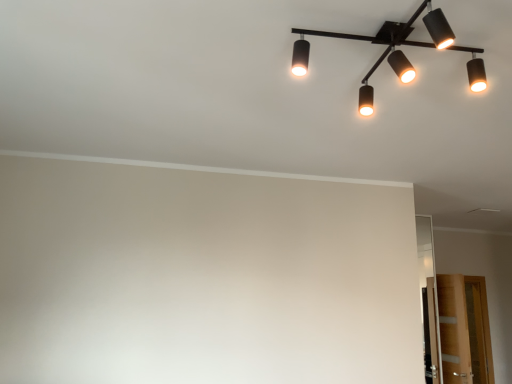
What do you see at coordinates (403, 35) in the screenshot? I see `matte black light fixture at upper center` at bounding box center [403, 35].

Locate an element on the screen. The width and height of the screenshot is (512, 384). matte black light fixture at upper center is located at coordinates (403, 35).

You are a GUI agent. You are given a task and a screenshot of the screen. Output one action in this format:
    pyautogui.click(x=<x>, y=<y>)
    Task: Click on the transparent glass door at lower right
    
    Given the screenshot: What is the action you would take?
    pyautogui.click(x=464, y=330)

What do you see at coordinates (464, 330) in the screenshot?
I see `transparent glass door at lower right` at bounding box center [464, 330].

Where is `matte black light fixture at upper center`? This screenshot has height=384, width=512. matte black light fixture at upper center is located at coordinates (403, 35).

From the picture: Considering the positions of objects matte black light fixture at upper center and transparent glass door at lower right in the image provided, who is more to the left, matte black light fixture at upper center or transparent glass door at lower right?

matte black light fixture at upper center.

Is the position of matte black light fixture at upper center more distant than that of transparent glass door at lower right?

No.

Is point (453, 46) positioned after point (464, 302)?

No.

From the image's perspective, between matte black light fixture at upper center and transparent glass door at lower right, who is located below?

From the image's view, transparent glass door at lower right is below.

From a real-world perspective, is matte black light fixture at upper center on transparent glass door at lower right?

Indeed, from a real-world perspective, matte black light fixture at upper center stands above transparent glass door at lower right.

In terms of width, does matte black light fixture at upper center look wider or thinner when compared to transparent glass door at lower right?

Clearly, matte black light fixture at upper center has more width compared to transparent glass door at lower right.

Between matte black light fixture at upper center and transparent glass door at lower right, which one has less height?

Standing shorter between the two is matte black light fixture at upper center.

Considering the relative sizes of matte black light fixture at upper center and transparent glass door at lower right in the image provided, is matte black light fixture at upper center smaller than transparent glass door at lower right?

Yes, matte black light fixture at upper center is smaller than transparent glass door at lower right.

Could transparent glass door at lower right be considered to be inside matte black light fixture at upper center?

Actually, transparent glass door at lower right is outside matte black light fixture at upper center.

Can you see matte black light fixture at upper center touching transparent glass door at lower right?

No.

Is matte black light fixture at upper center aimed at transparent glass door at lower right?

No, matte black light fixture at upper center is not aimed at transparent glass door at lower right.

What's the angular difference between matte black light fixture at upper center and transparent glass door at lower right's facing directions?

Result: The angle between the facing direction of matte black light fixture at upper center and the facing direction of transparent glass door at lower right is 5.62 degrees.

The image size is (512, 384). In order to click on glass door behind the matte black light fixture at upper center in this screenshot , I will do `click(464, 330)`.

Is transparent glass door at lower right at the right side of matte black light fixture at upper center?

Yes.

Is transparent glass door at lower right positioned behind matte black light fixture at upper center?

Yes, it is.

Does point (473, 343) appear closer or farther from the camera than point (391, 30)?

Point (473, 343) appears to be farther away from the viewer than point (391, 30).

Looking at this image, from the image's perspective, which one is positioned higher, transparent glass door at lower right or matte black light fixture at upper center?

matte black light fixture at upper center.

From a real-world perspective, which is physically below, transparent glass door at lower right or matte black light fixture at upper center?

transparent glass door at lower right, from a real-world perspective.

Between transparent glass door at lower right and matte black light fixture at upper center, which one has smaller width?

With smaller width is transparent glass door at lower right.

Is transparent glass door at lower right shorter than matte black light fixture at upper center?

Incorrect, the height of transparent glass door at lower right does not fall short of that of matte black light fixture at upper center.

Is transparent glass door at lower right bigger than matte black light fixture at upper center?

Yes.

Is transparent glass door at lower right positioned beyond the bounds of matte black light fixture at upper center?

Yes, transparent glass door at lower right is outside of matte black light fixture at upper center.

Is transparent glass door at lower right placed right next to matte black light fixture at upper center?

There is a gap between transparent glass door at lower right and matte black light fixture at upper center.

Is transparent glass door at lower right oriented away from matte black light fixture at upper center?

transparent glass door at lower right does not have its back to matte black light fixture at upper center.

What's the angular difference between transparent glass door at lower right and matte black light fixture at upper center's facing directions?

transparent glass door at lower right and matte black light fixture at upper center are facing 5.62 degrees away from each other.

Looking at this image, how far apart are transparent glass door at lower right and matte black light fixture at upper center?

transparent glass door at lower right is 3.07 meters from matte black light fixture at upper center.

The width and height of the screenshot is (512, 384). I want to click on glass door below the matte black light fixture at upper center (from a real-world perspective), so tap(464, 330).

The image size is (512, 384). Find the location of `lamp to the left of transparent glass door at lower right`. lamp to the left of transparent glass door at lower right is located at coordinates (403, 35).

Where is `glass door below the matte black light fixture at upper center (from a real-world perspective)`? This screenshot has width=512, height=384. glass door below the matte black light fixture at upper center (from a real-world perspective) is located at coordinates (464, 330).